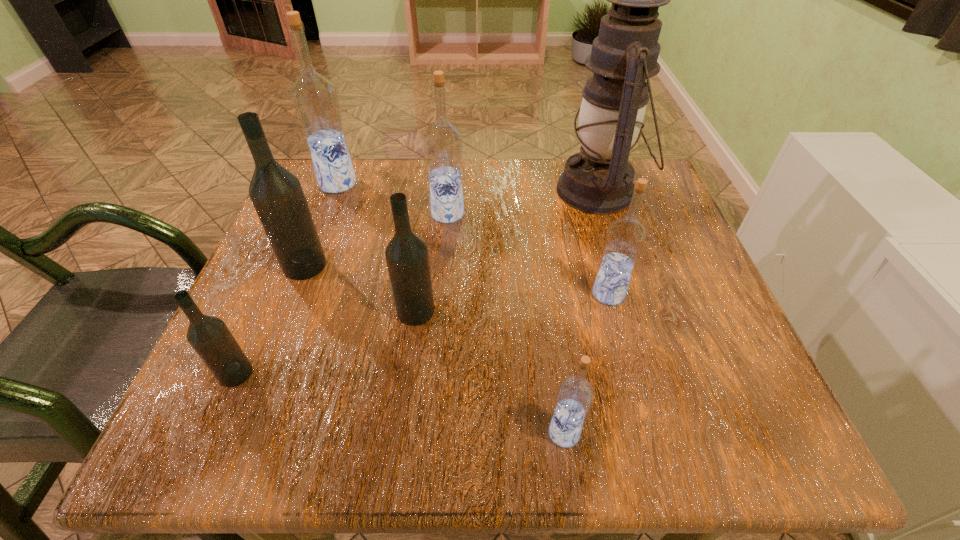
The height and width of the screenshot is (540, 960). In the image, there is a desktop. What are the coordinates of `free space at the near edge` in the screenshot? It's located at (309, 401).

You are a GUI agent. You are given a task and a screenshot of the screen. Output one action in this format:
    pyautogui.click(x=<x>, y=<y>)
    Task: Click on the vacant position at the right edge of the desktop
    The width and height of the screenshot is (960, 540).
    Given the screenshot: What is the action you would take?
    pyautogui.click(x=658, y=242)

In order to click on free region at the far left corner of the desktop in this screenshot , I will do `click(363, 195)`.

Identify the location of vacant space at the near left corner of the desktop. Image resolution: width=960 pixels, height=540 pixels. (296, 420).

The width and height of the screenshot is (960, 540). I want to click on vacant area at the far right corner, so tap(647, 188).

This screenshot has width=960, height=540. Find the location of `empty space that is in between the farthest black vodka and the tallest vodka`. empty space that is in between the farthest black vodka and the tallest vodka is located at coordinates (322, 225).

Image resolution: width=960 pixels, height=540 pixels. I want to click on unoccupied area between the fifth nearest object and the oil lamp, so click(x=452, y=228).

You are a GUI agent. You are given a task and a screenshot of the screen. Output one action in this format:
    pyautogui.click(x=<x>, y=<y>)
    Task: Click on the free point between the second blue vodka from left to right and the oil lamp
    
    Given the screenshot: What is the action you would take?
    pyautogui.click(x=523, y=202)

This screenshot has height=540, width=960. In order to click on vacant area that lies between the fifth nearest vodka and the leftmost blue vodka in this screenshot , I will do `click(322, 225)`.

You are a GUI agent. You are given a task and a screenshot of the screen. Output one action in this format:
    pyautogui.click(x=<x>, y=<y>)
    Task: Click on the vacant space in between the oil lamp and the second nearest blue vodka
    The height and width of the screenshot is (540, 960).
    Given the screenshot: What is the action you would take?
    pyautogui.click(x=604, y=242)